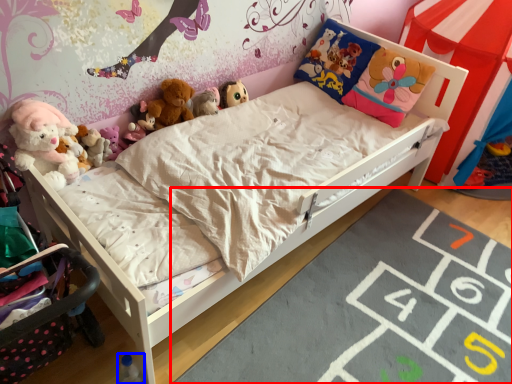
Question: Which object is closer to the camera taking this photo, mat (highlighted by a red box) or toy (highlighted by a blue box)?

Choices:
 (A) mat
 (B) toy

Answer: (A)